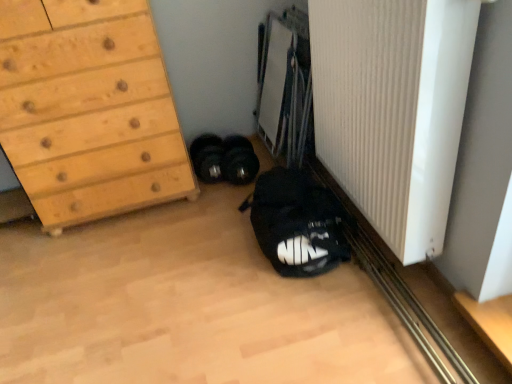
Question: From a real-world perspective, is white ribbed radiator at lower right positioned above or below black rubber dumbbells at center, marked as the second footwear in a left-to-right arrangement?

Choices:
 (A) below
 (B) above

Answer: (B)

Question: From their relative heights in the image, would you say white ribbed radiator at lower right is taller or shorter than black rubber dumbbells at center, acting as the 1th footwear starting from the right?

Choices:
 (A) short
 (B) tall

Answer: (B)

Question: Which is nearer to the white ribbed radiator at lower right?

Choices:
 (A) black rubber dumbbells at center, marked as the second footwear in a left-to-right arrangement
 (B) wooden chest of drawers at left
 (C) black matte sneakers at lower left, placed as the second footwear when sorted from right to left
 (D) black fabric backpack at lower center

Answer: (D)

Question: Which object is positioned farthest from the black rubber dumbbells at center, marked as the second footwear in a left-to-right arrangement?

Choices:
 (A) wooden chest of drawers at left
 (B) white ribbed radiator at lower right
 (C) black matte sneakers at lower left, placed as the second footwear when sorted from right to left
 (D) black fabric backpack at lower center

Answer: (B)